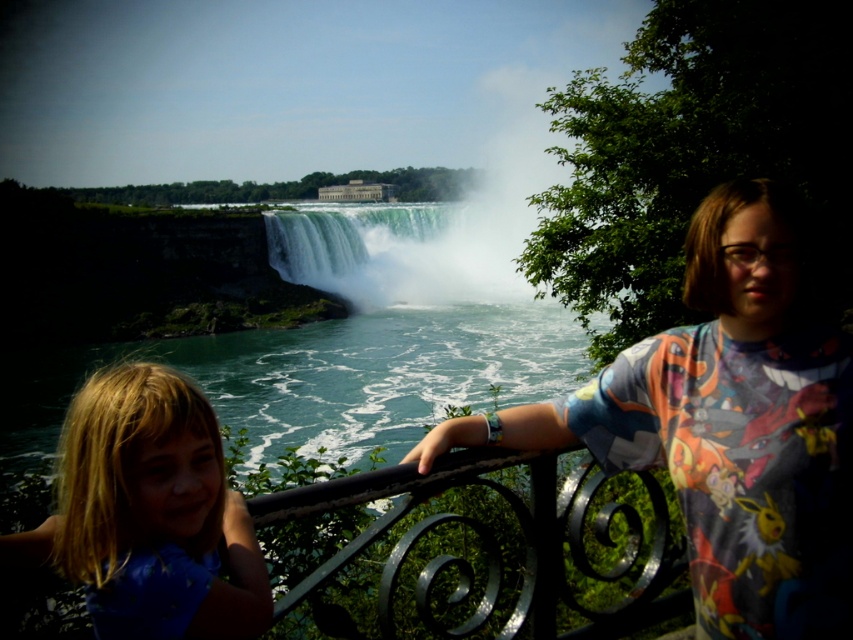
From the picture: You are standing at the viewing platform of Niagara Falls. You notice a person wearing a multicolored fabric shirt at right and the green translucent water at center. From your perspective, which object is positioned to the left?

The multicolored fabric shirt at right is to the left of the green translucent water at center.